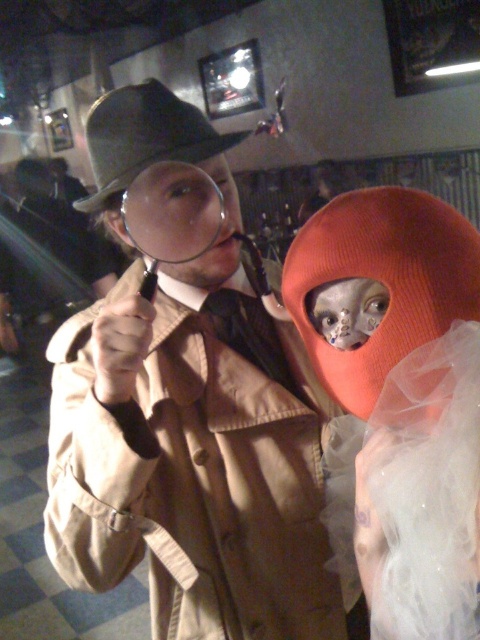
Question: Which object appears farthest from the camera in this image?

Choices:
 (A) brown felt hat at upper left
 (B) brown leather trench coat at center
 (C) orange knitted hat at center

Answer: (A)

Question: Does orange knitted hat at center appear on the right side of brown felt hat at upper left?

Choices:
 (A) no
 (B) yes

Answer: (B)

Question: Is orange knitted hat at center positioned behind brown felt hat at upper left?

Choices:
 (A) yes
 (B) no

Answer: (B)

Question: Which of the following is the farthest from the observer?

Choices:
 (A) brown leather trench coat at center
 (B) brown felt hat at upper left

Answer: (B)

Question: Which point appears farthest from the camera in this image?

Choices:
 (A) (380, 381)
 (B) (256, 509)

Answer: (B)

Question: Can you confirm if brown leather trench coat at center is bigger than brown felt hat at upper left?

Choices:
 (A) no
 (B) yes

Answer: (B)